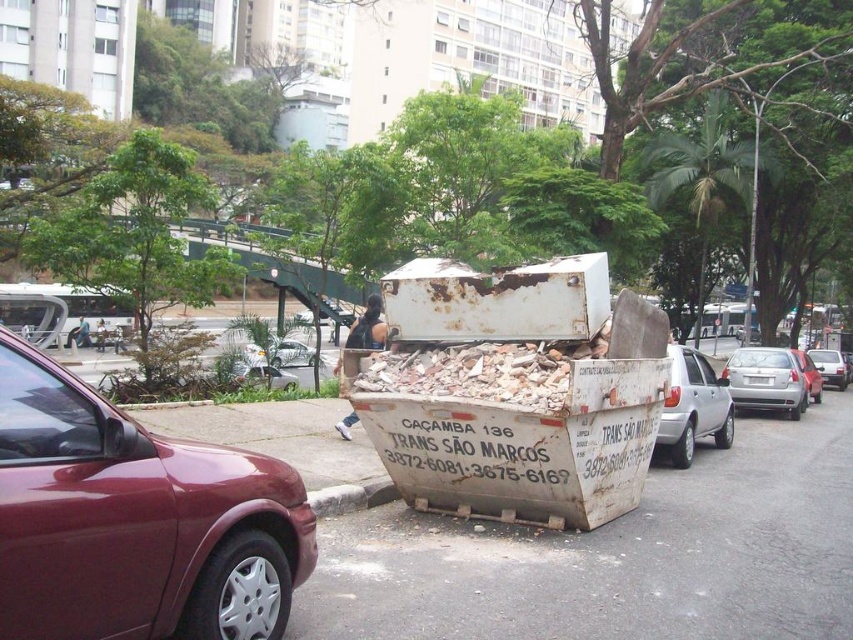
You are a delivery driver approaching the gray concrete curb at lower center and the metallic silver sedan at right. Which object is closer to you as you drive along the street?

The gray concrete curb at lower center is closer to you because it is in front of the metallic silver sedan at right, meaning it is positioned nearer to your current viewpoint.

You are standing on the sidewalk and see two points marked on the dumpster. The first point is at coordinates point (393, 490) and the second point is at point (821, 356). Which point is closer to you?

The point at coordinates point (393, 490) is closer to you than the point at point (821, 356).